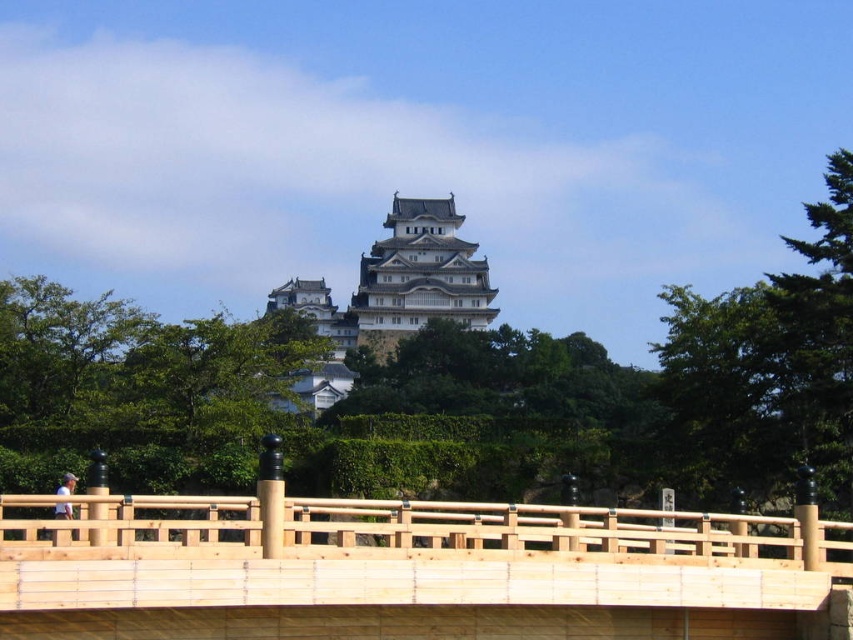
Question: Where is light brown wooden bridge at center located in relation to white stone tower at center in the image?

Choices:
 (A) left
 (B) right

Answer: (A)

Question: Does green leafy tree at upper right appear over white stone tower at center?

Choices:
 (A) no
 (B) yes

Answer: (A)

Question: Which object is closer to the camera taking this photo?

Choices:
 (A) green leafy tree at upper right
 (B) white stone tower at center

Answer: (A)

Question: Is light brown wooden bridge at center bigger than green leafy tree at upper right?

Choices:
 (A) no
 (B) yes

Answer: (A)

Question: Which is farther from the green leafy tree at upper right?

Choices:
 (A) light brown wooden bridge at center
 (B) white stone tower at center

Answer: (B)

Question: Which of these objects is positioned farthest from the white stone tower at center?

Choices:
 (A) green leafy tree at upper right
 (B) light brown wooden bridge at center

Answer: (B)